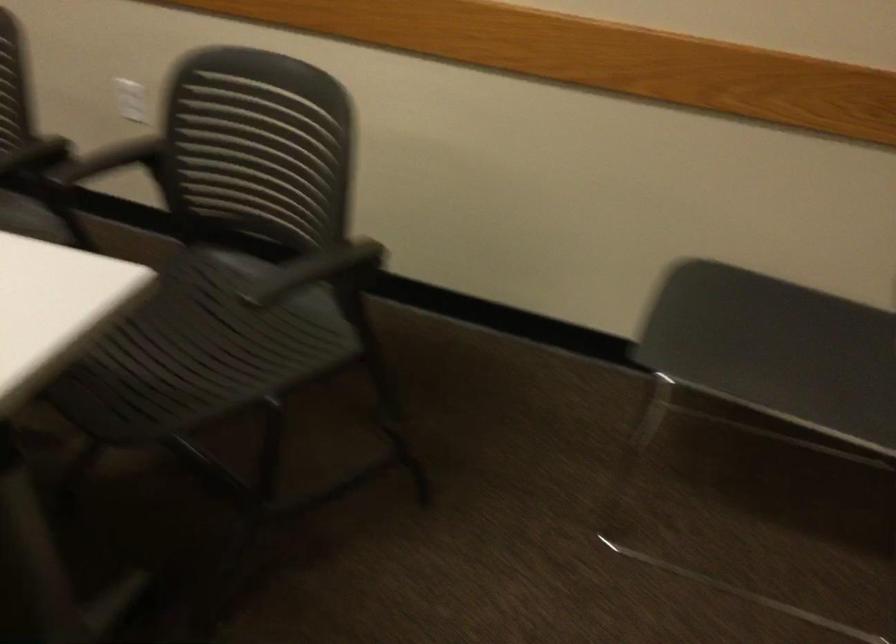
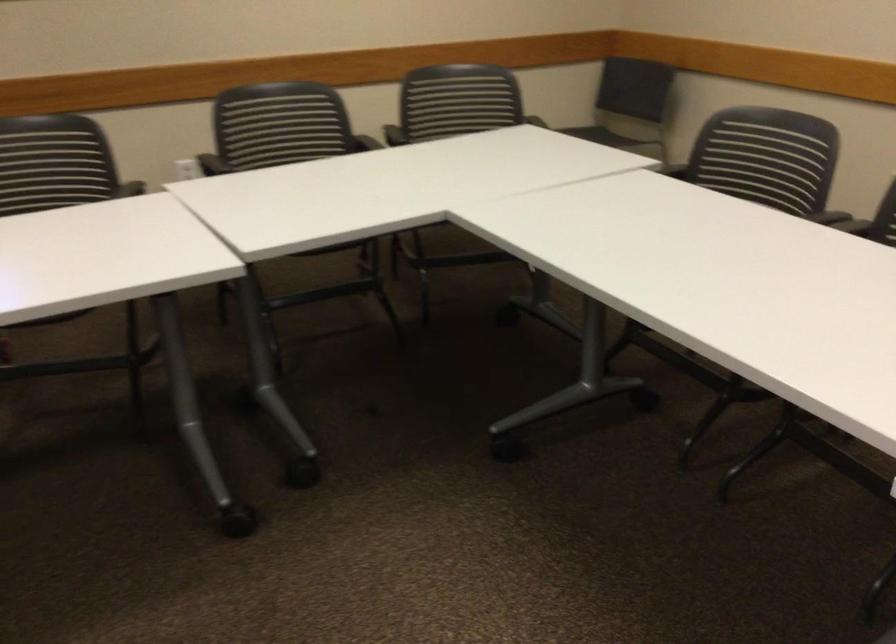
Question: I am providing you with two images of the same scene from different viewpoints. After the viewpoint changes to image2, which objects are now occluded?

Choices:
 (A) black chair armrest
 (B) black chair sitting surface
 (C) chair sitting surface
 (D) closet door knob

Answer: (C)